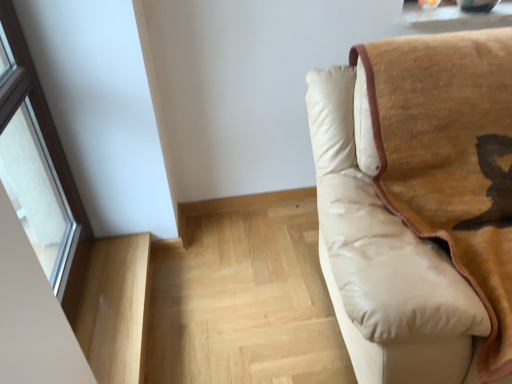
Identify the location of free space above light wood stairwell at lower left, the 1th stairwell positioned from the right (from a real-world perspective). (248, 279).